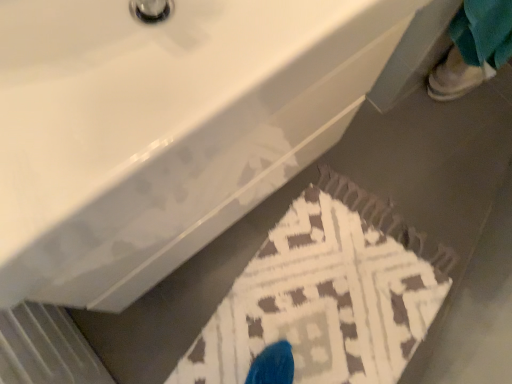
This screenshot has width=512, height=384. Identify the location of unoccupied region to the right of white leather shoe at upper right. (490, 105).